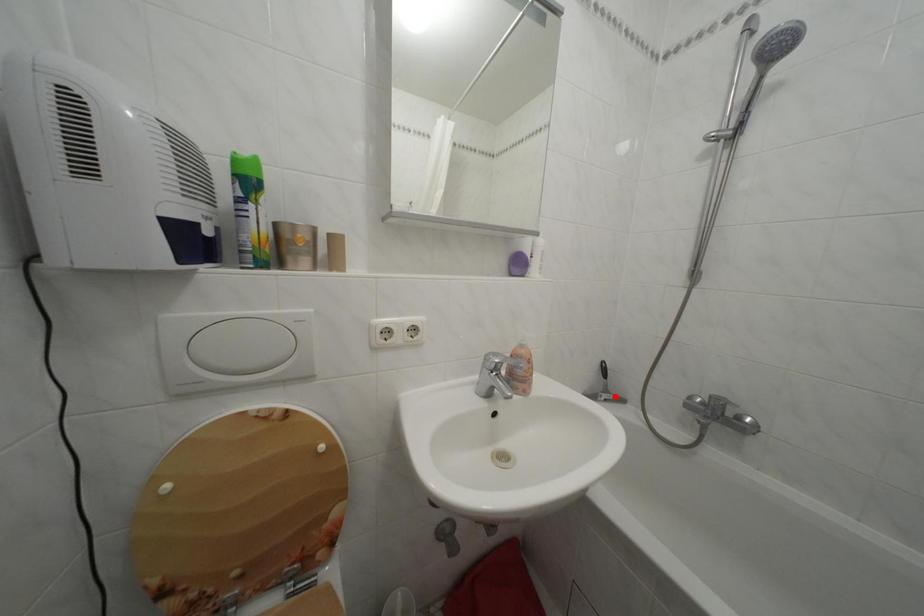
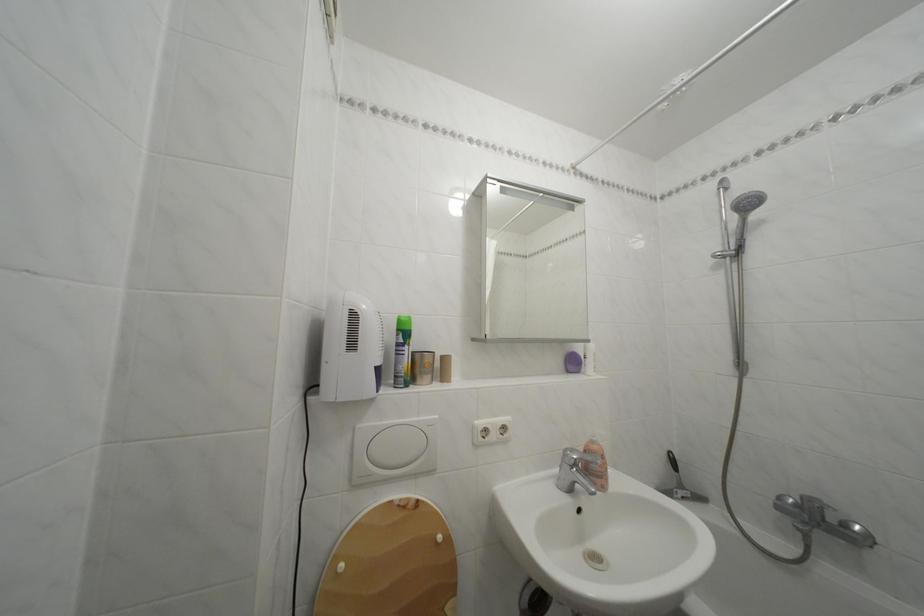
Question: I am providing you with two images of the same scene from different viewpoints. Given a red point in image1, look at the same physical point in image2. Is it:

Choices:
 (A) Closer to the viewpoint
 (B) Farther from the viewpoint

Answer: (A)